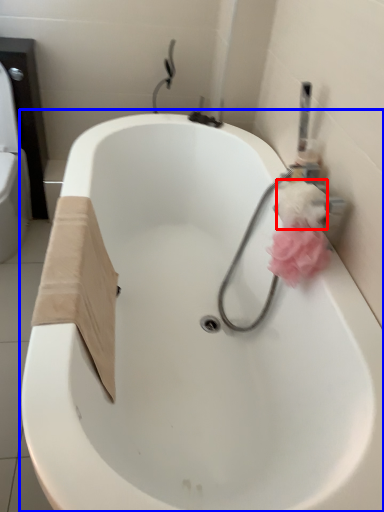
Question: Which object appears farthest to the camera in this image, toilet paper (highlighted by a red box) or bathtub (highlighted by a blue box)?

Choices:
 (A) toilet paper
 (B) bathtub

Answer: (A)